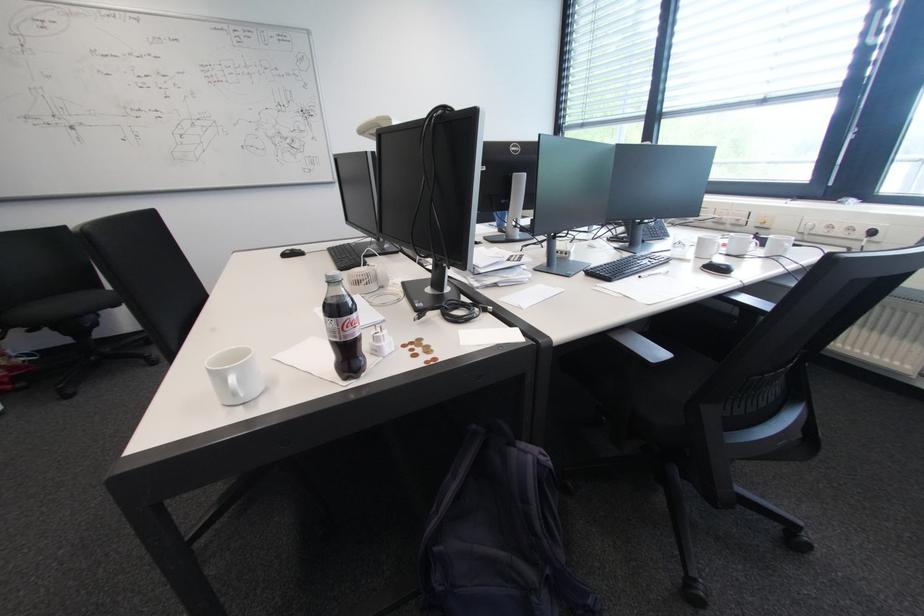
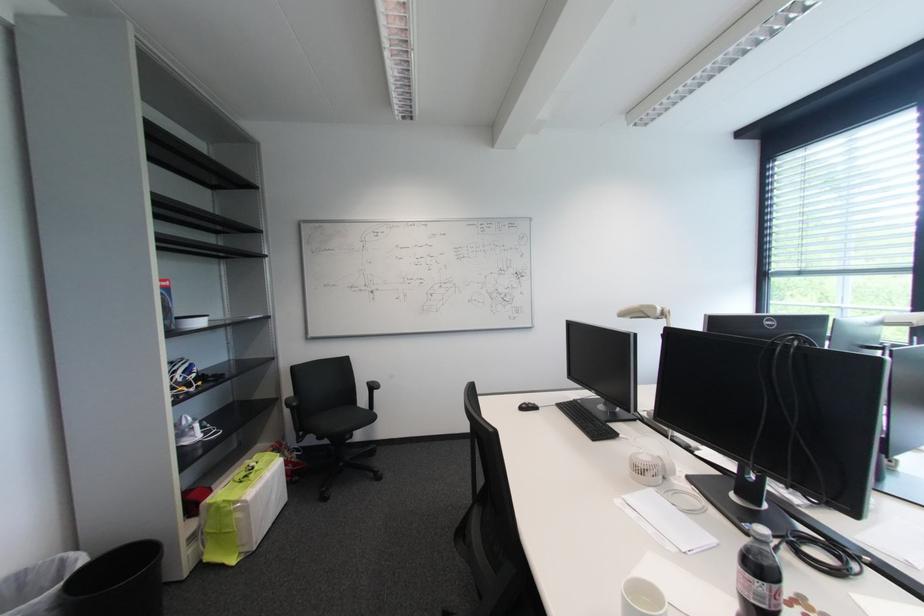
The point at [386,128] is marked in the first image. Where is the corresponding point in the second image?

(649, 314)